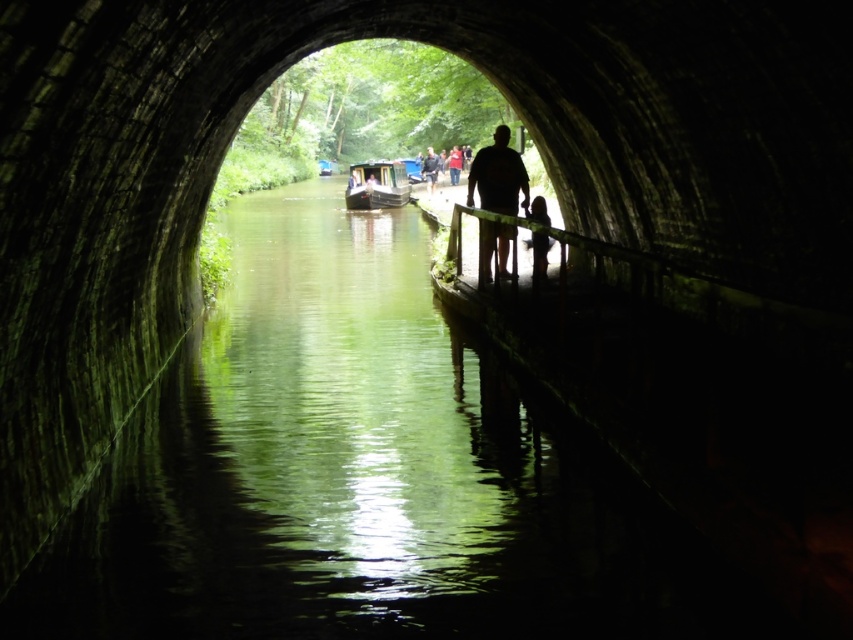
Question: Can you confirm if silhouette figure at center is thinner than dark blue shirt at center?

Choices:
 (A) yes
 (B) no

Answer: (A)

Question: Which of these objects is positioned closest to the silhouette figure at center?

Choices:
 (A) silhouette wooden figure at center
 (B) wooden polished boat at center

Answer: (A)

Question: Can you confirm if silhouette wooden figure at center is thinner than dark blue shirt at center?

Choices:
 (A) yes
 (B) no

Answer: (A)

Question: Based on their relative distances, which object is nearer to the dark blue shirt at center?

Choices:
 (A) silhouette wooden figure at center
 (B) silhouette figure at center
 (C) wooden polished boat at center

Answer: (C)

Question: Is silhouette wooden figure at center bigger than dark blue shirt at center?

Choices:
 (A) no
 (B) yes

Answer: (A)

Question: Which object appears farthest from the camera in this image?

Choices:
 (A) silhouette wooden figure at center
 (B) dark blue shirt at center
 (C) silhouette figure at center
 (D) wooden polished boat at center

Answer: (B)